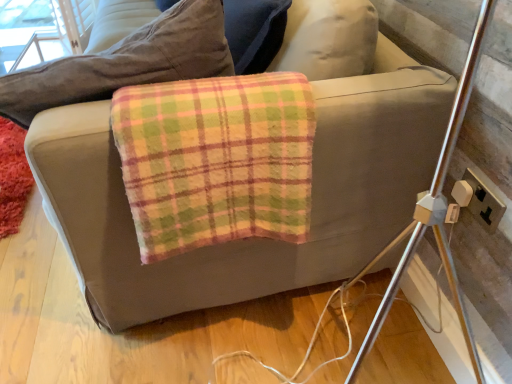
At what (x,y) coordinates should I click in order to perform the action: click on vacant area on top of fluffy red mat at lower left (from a real-world perspective). Please return your answer as a coordinate pair (x, y). Image resolution: width=512 pixels, height=384 pixels. Looking at the image, I should click on pos(8,152).